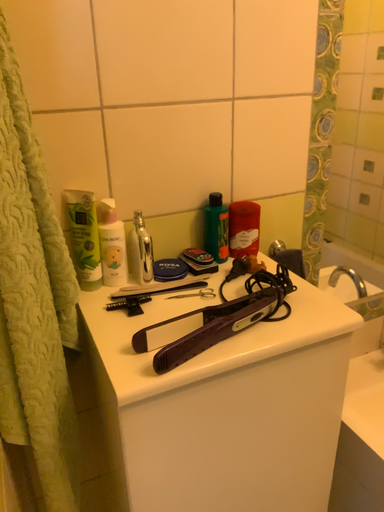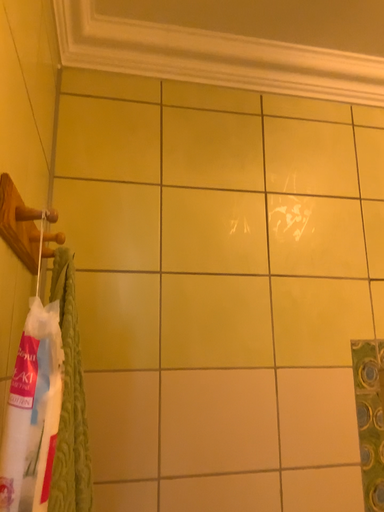
Question: How did the camera likely rotate when shooting the video?

Choices:
 (A) rotated right
 (B) rotated left

Answer: (B)